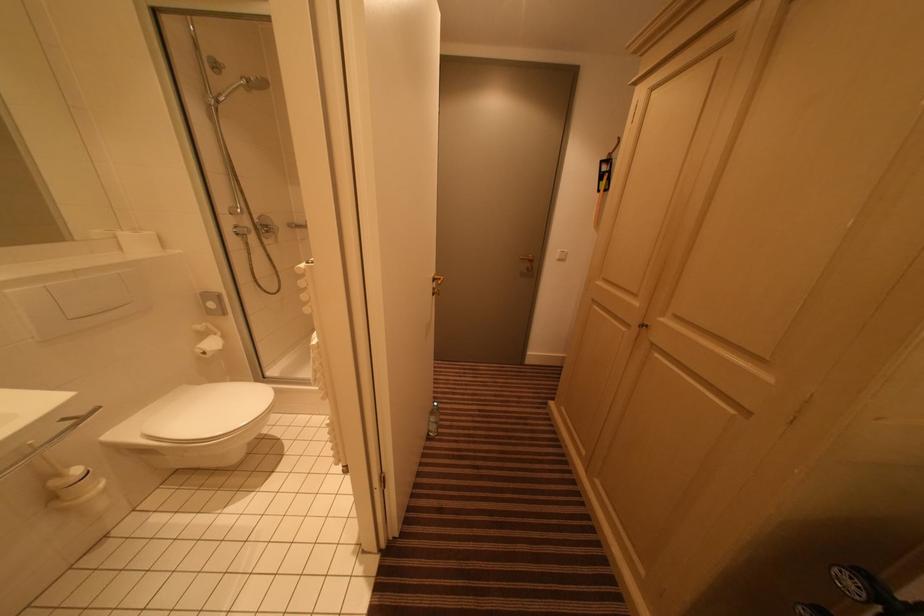
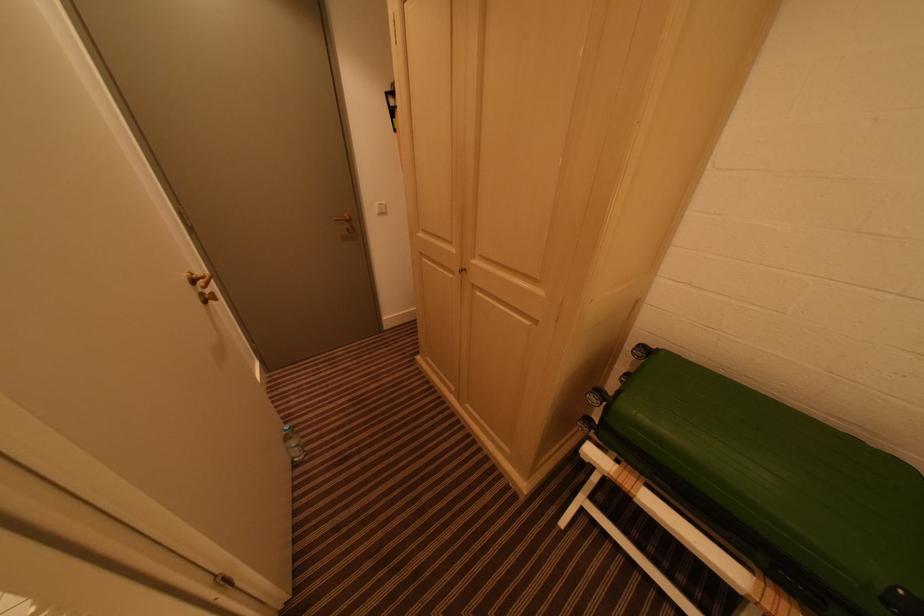
The point at (439, 415) is marked in the first image. Where is the corresponding point in the second image?

(293, 440)